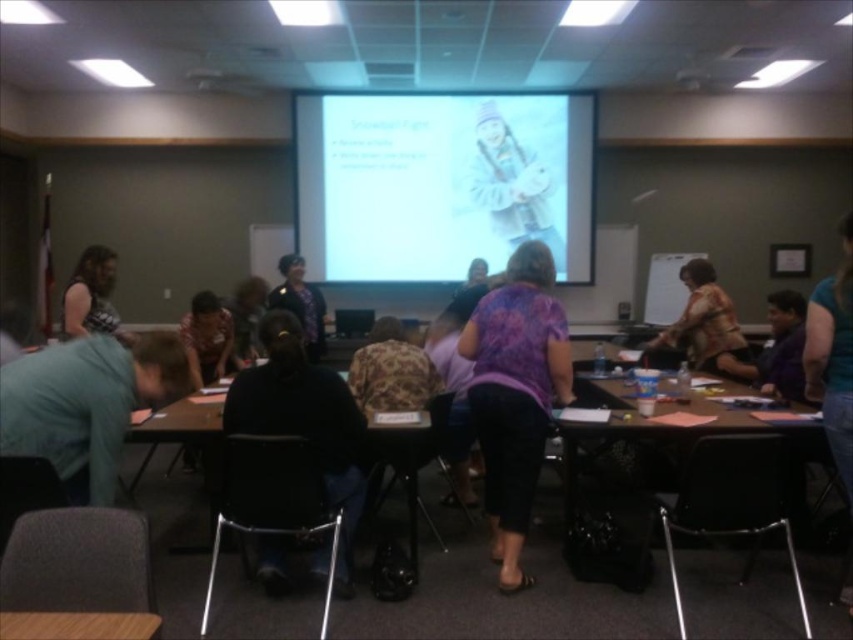
You are standing in a conference room and want to present a video that requires the audience to see the screen clearly from their seats. The recommended viewing distance for the video is 20 feet. Is the white glossy projector screen at upper center positioned at an appropriate distance for this requirement?

The distance between the white glossy projector screen at upper center and the viewer is 20.21 feet, which is slightly beyond the recommended 20 feet. However, this minor difference is unlikely to significantly impact visibility, so the screen is positioned appropriately for the presentation.

You are a person sitting in the conference room and want to check the distance between the white glossy projector screen at upper center and the purple fabric shirt at center. If you can only move forward in a straight line, will you be able to reach the screen before the shirt?

The white glossy projector screen at upper center is 11.31 feet away from the purple fabric shirt at center. Since you are moving forward in a straight line, you will reach the purple fabric shirt at center first before the screen because the shirt is closer to your current position.

You are an attendee in the conference room and want to see the person wearing the purple fabric shirt at center. Is the striped shirt at center blocking your view of them?

The purple fabric shirt at center is positioned under the striped shirt at center, so the striped shirt at center is blocking the view of the purple fabric shirt at center.